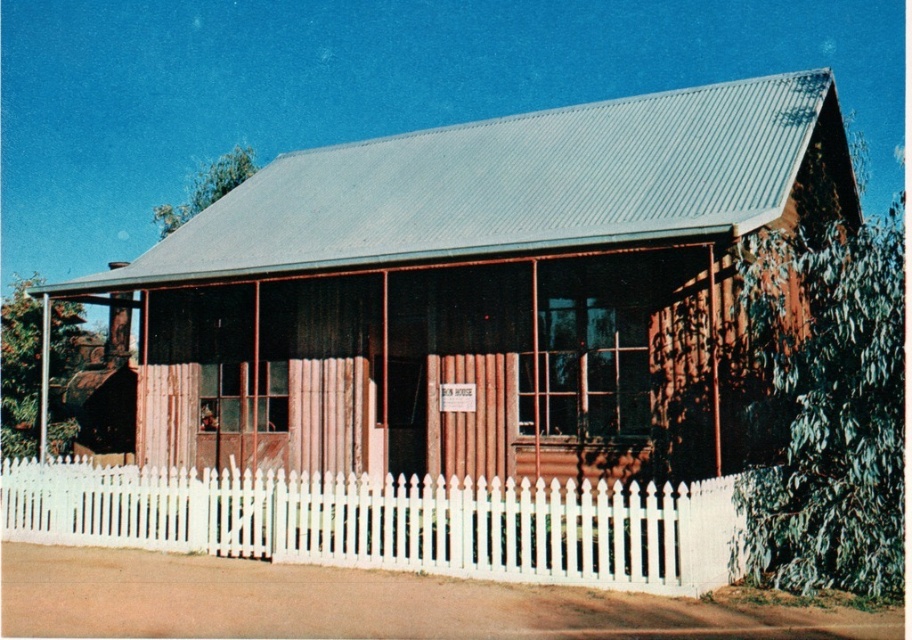
Based on the photo, you are standing in front of the rustic wooden building and want to determine the relative positions of two points marked on the structure. Which point is closer to you, point at location (271, 452) or point at location (623, 577)?

Point at location (271, 452) is closer to you because it is further to the viewer than point at location (623, 577).

You are standing in front of the brown wooden hut at center and want to see over the white picket fence at center to the other side. Based on their heights, do you think you can see over the fence?

The brown wooden hut at center has a greater height compared to the white picket fence at center, so yes, you can see over the white picket fence at center because the brown wooden hut at center is taller.